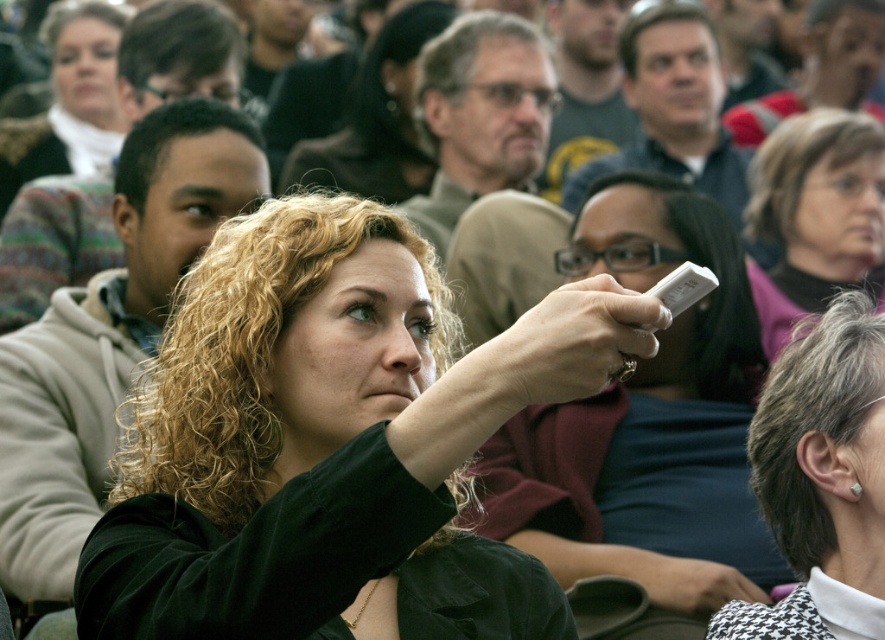
You are organizing a charity event and need to decide which garment to display first. The dark green velvet jacket at center and the matte black hoodie at upper left are both candidates. Based on their size, which one should you choose to occupy more space on the display rack?

The matte black hoodie at upper left should be chosen to occupy more space on the display rack since it occupies more space than the dark green velvet jacket at center.

You are standing in a lecture hall and see a matte black phone at center. If you want to reach it quickly, should you walk forward or backward?

The matte black phone at center is 11.74 meters away from you, so you should walk forward to reach it quickly.